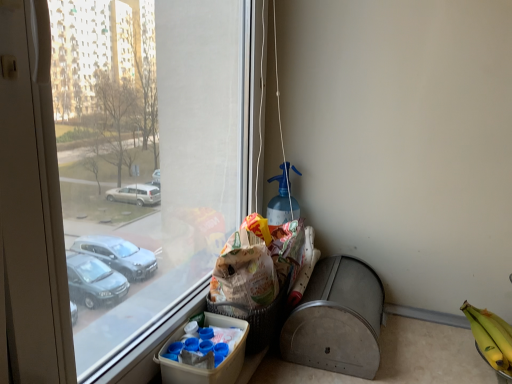
Question: Do you think yellow matte bananas at lower right is within white paper grocery bag at center, or outside of it?

Choices:
 (A) inside
 (B) outside

Answer: (B)

Question: Is yellow matte bananas at lower right wider or thinner than white paper grocery bag at center?

Choices:
 (A) wide
 (B) thin

Answer: (A)

Question: Estimate the real-world distances between objects in this image. Which object is farther from the brown paper bag at lower center?

Choices:
 (A) yellow matte bananas at lower right
 (B) white paper grocery bag at center
 (C) metallic gray recycling bin at lower right
 (D) white cardboard box at lower center

Answer: (A)

Question: Estimate the real-world distances between objects in this image. Which object is closer to the brown paper bag at lower center?

Choices:
 (A) white paper grocery bag at center
 (B) white cardboard box at lower center
 (C) metallic gray recycling bin at lower right
 (D) yellow matte bananas at lower right

Answer: (A)